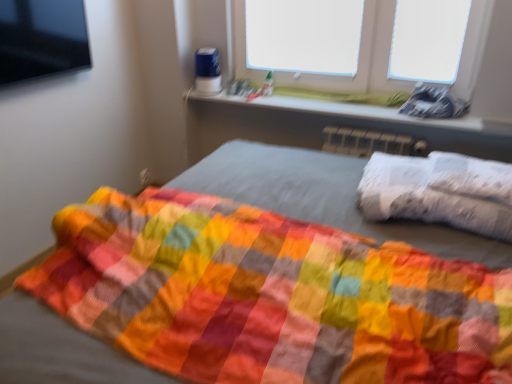
Question: In terms of height, does white matte window screen at upper center, the second window screen viewed from the right, look taller or shorter compared to white plastic window sill at upper center?

Choices:
 (A) short
 (B) tall

Answer: (B)

Question: In the image, is white matte window screen at upper center, the first window screen when ordered from left to right, positioned in front of or behind white plastic window sill at upper center?

Choices:
 (A) front
 (B) behind

Answer: (B)

Question: Which object is the farthest from the white plastic window sill at upper center?

Choices:
 (A) transparent plastic window at upper center
 (B) white matte window screen at upper center, the second window screen viewed from the right
 (C) transparent plastic at upper right, the 1th window screen positioned from the right
 (D) white textured pillow at right

Answer: (D)

Question: Which is nearer to the white matte window screen at upper center, the first window screen when ordered from left to right?

Choices:
 (A) transparent plastic window at upper center
 (B) white plastic window sill at upper center
 (C) transparent plastic at upper right, the 1th window screen positioned from the right
 (D) white textured pillow at right

Answer: (A)